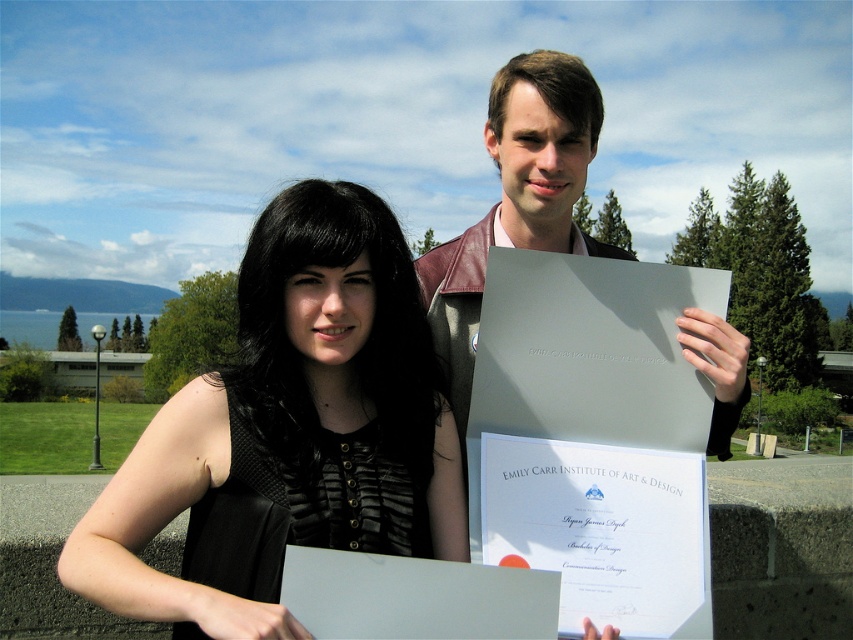
Who is higher up, black matte dress at center or leather jacket at center?

leather jacket at center is above.

Does black matte dress at center come behind leather jacket at center?

No, it is not.

Where is `black matte dress at center`? Image resolution: width=853 pixels, height=640 pixels. black matte dress at center is located at coordinates (288, 432).

You are a GUI agent. You are given a task and a screenshot of the screen. Output one action in this format:
    pyautogui.click(x=<x>, y=<y>)
    Task: Click on the black matte dress at center
    
    Given the screenshot: What is the action you would take?
    pyautogui.click(x=288, y=432)